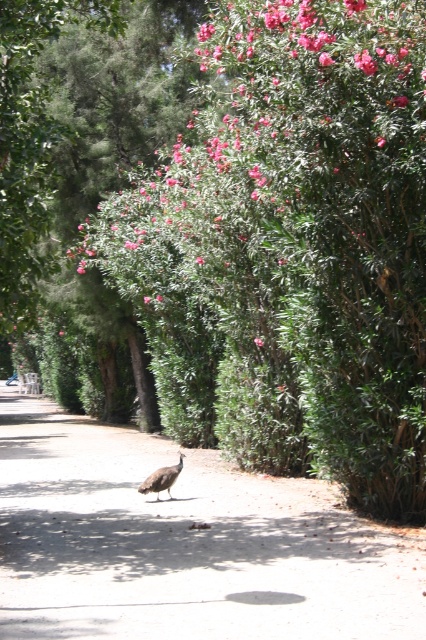
Question: Can you confirm if brown dirt path at center is positioned to the right of gray feathered peacock at center?

Choices:
 (A) no
 (B) yes

Answer: (A)

Question: Does gray feathered peacock at center appear on the right side of pink matte flower at upper center?

Choices:
 (A) no
 (B) yes

Answer: (A)

Question: Does brown dirt path at center lie behind gray feathered peacock at center?

Choices:
 (A) no
 (B) yes

Answer: (A)

Question: Which is farther from the pink matte flower at upper center?

Choices:
 (A) brown dirt path at center
 (B) gray feathered peacock at center

Answer: (A)

Question: Among these objects, which one is farthest from the camera?

Choices:
 (A) gray feathered peacock at center
 (B) pink matte flower at upper center
 (C) brown dirt path at center

Answer: (B)

Question: Among these points, which one is farthest from the camera?

Choices:
 (A) (314, 582)
 (B) (178, 456)

Answer: (B)